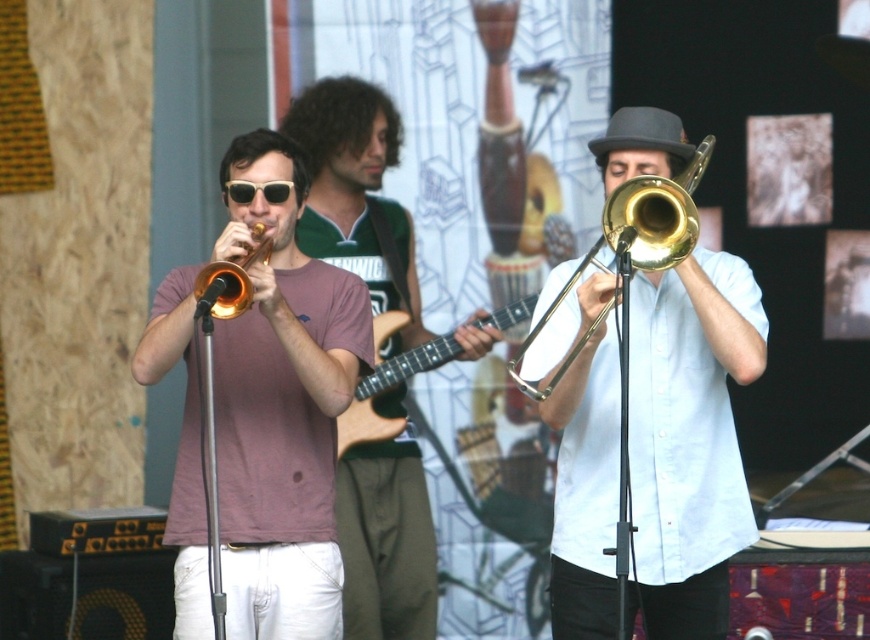
You are a photographer at the live music performance. You want to take a photo of the matte pink shirt at center and the gold brass trumpet at center. Which one is positioned to the left of the other?

The matte pink shirt at center is to the left of the gold brass trumpet at center.

You are a stagehand who needs to place a new microphone stand at the exact center of the stage. The stage is a rectangular area with coordinates from 0 to 1 on both axes. The gold shiny trombone at center is located at point 0.384, 0.725. Is the trombone positioned to the left or right of the stage center along the horizontal axis?

The gold shiny trombone at center is located at point 0.384 on the horizontal axis. Since the stage center is at 0.5, the trombone is to the left of the stage center along the horizontal axis.